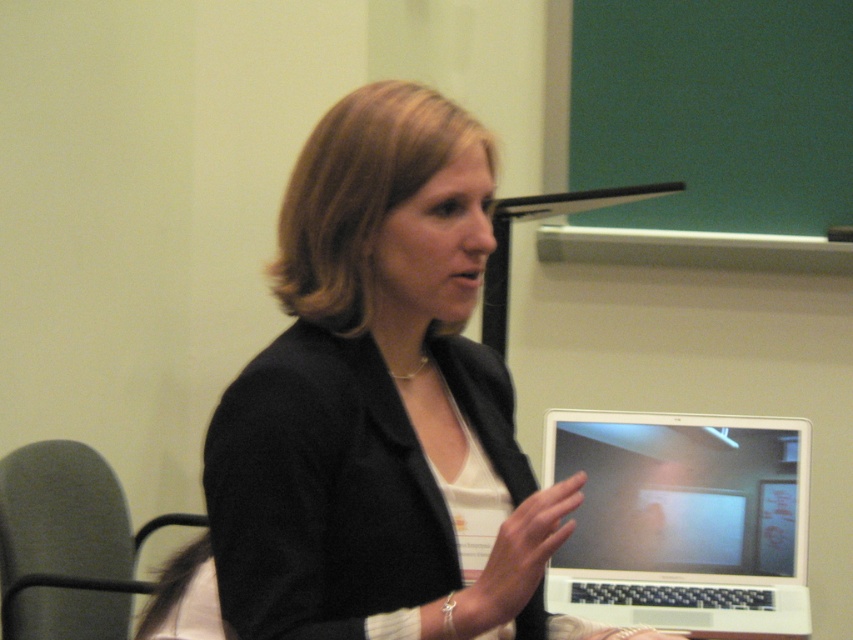
Question: Which point is farther to the camera?

Choices:
 (A) black matte blazer at center
 (B) green matte/blackboard at upper right
 (C) dark gray fabric chair at left

Answer: (B)

Question: Can you confirm if black matte blazer at center is positioned to the right of green matte/blackboard at upper right?

Choices:
 (A) yes
 (B) no

Answer: (B)

Question: Is green matte/blackboard at upper right smaller than dark gray fabric chair at left?

Choices:
 (A) yes
 (B) no

Answer: (A)

Question: Estimate the real-world distances between objects in this image. Which object is farther from the green matte/blackboard at upper right?

Choices:
 (A) black matte blazer at center
 (B) white glossy laptop at lower right

Answer: (A)

Question: Which object is positioned closest to the dark gray fabric chair at left?

Choices:
 (A) green matte/blackboard at upper right
 (B) black matte blazer at center
 (C) white glossy laptop at lower right

Answer: (C)

Question: Does white glossy laptop at lower right have a greater width compared to dark gray fabric chair at left?

Choices:
 (A) no
 (B) yes

Answer: (B)